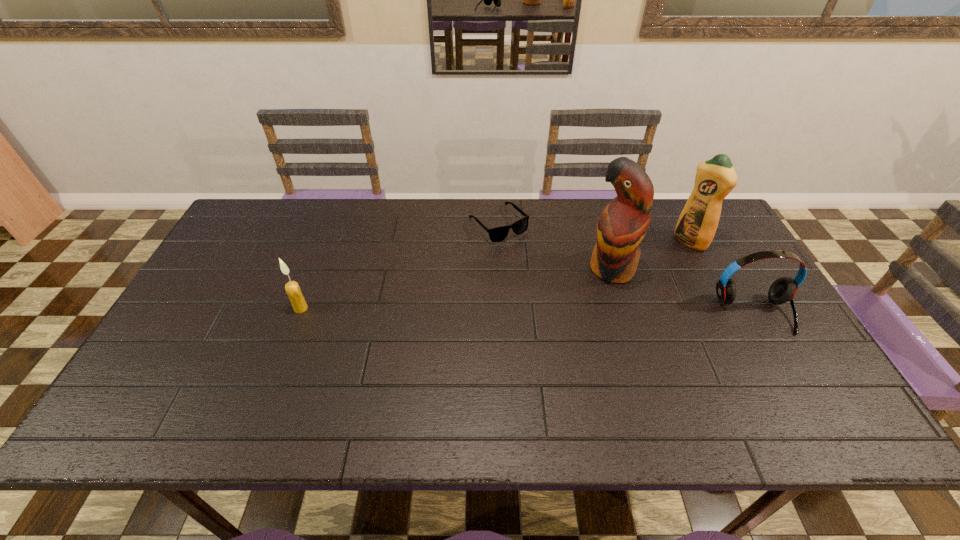
Where is `vacant position in the image that satisfies the following two spatial constraints: 1. on the front side of the shortest object; 2. on the left side of the parrot`? vacant position in the image that satisfies the following two spatial constraints: 1. on the front side of the shortest object; 2. on the left side of the parrot is located at coordinates (500, 268).